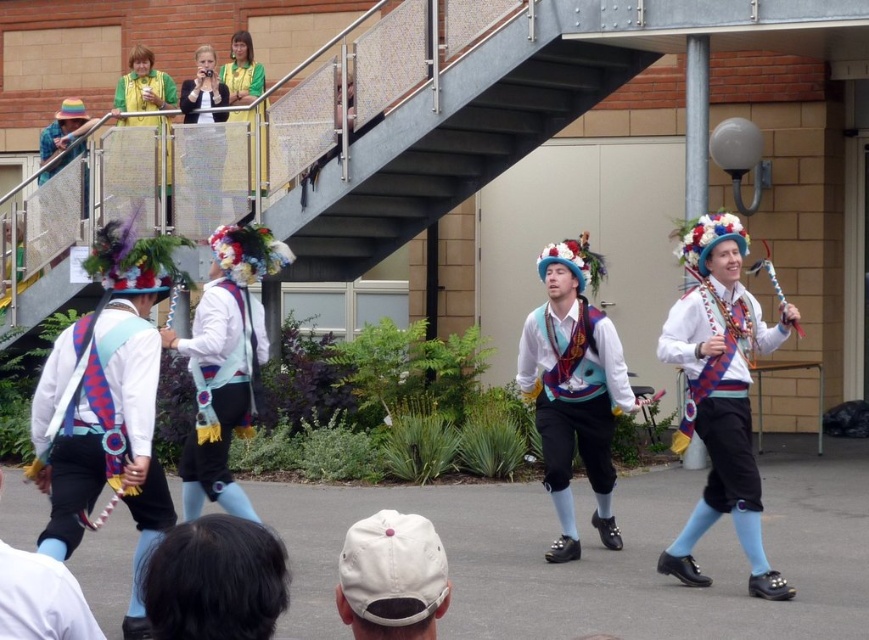
Question: Estimate the real-world distances between objects in this image. Which object is farther from the matte blue fabric vest at center?

Choices:
 (A) white fabric cap at lower center
 (B) matte yellow vest at upper left
 (C) matte black vest at upper left

Answer: (B)

Question: Which point is closer to the camera taking this photo?

Choices:
 (A) (538, 397)
 (B) (71, 150)
 (C) (249, 116)
 (D) (64, 600)

Answer: (D)

Question: Is the position of matte blue vest at center more distant than that of matte black vest at upper left?

Choices:
 (A) no
 (B) yes

Answer: (A)

Question: Does matte blue fabric sash at center have a larger size compared to matte blue vest at center?

Choices:
 (A) no
 (B) yes

Answer: (A)

Question: Can you confirm if matte blue fabric sash at center is bigger than matte blue vest at center?

Choices:
 (A) no
 (B) yes

Answer: (A)

Question: Which object is positioned farthest from the matte blue fabric sash at center?

Choices:
 (A) dark brown hair at lower center
 (B) matte blue vest at center

Answer: (A)